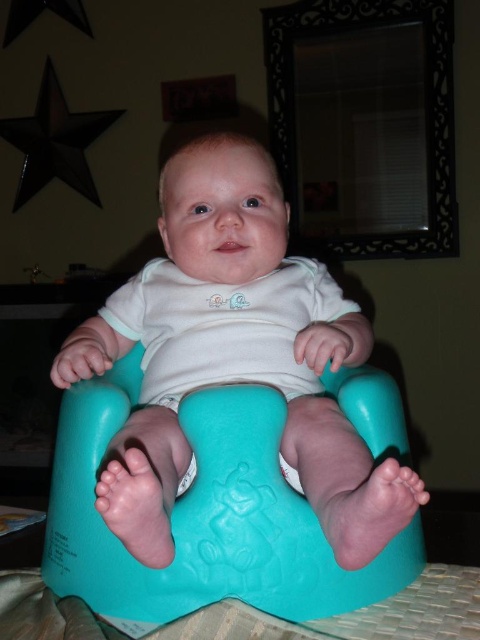
Describe the element at coordinates (235, 355) in the screenshot. This screenshot has width=480, height=640. I see `teal rubber potty at center` at that location.

Is point (165, 497) less distant than point (418, 576)?

That is True.

At what (x,y) coordinates should I click in order to perform the action: click on teal rubber potty at center. Please return your answer as a coordinate pair (x, y). The image size is (480, 640). Looking at the image, I should click on (235, 355).

This screenshot has height=640, width=480. I want to click on teal rubber potty at center, so click(235, 355).